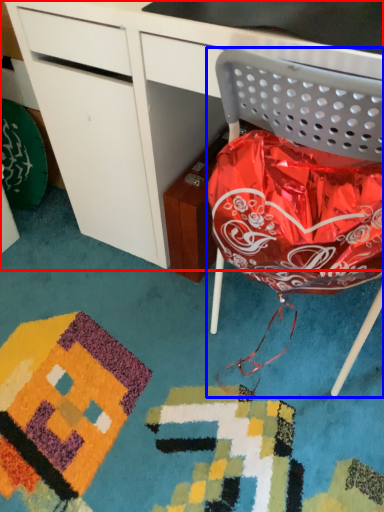
Question: Which of the following is the closest to the observer, desk (highlighted by a red box) or chair (highlighted by a blue box)?

Choices:
 (A) desk
 (B) chair

Answer: (B)